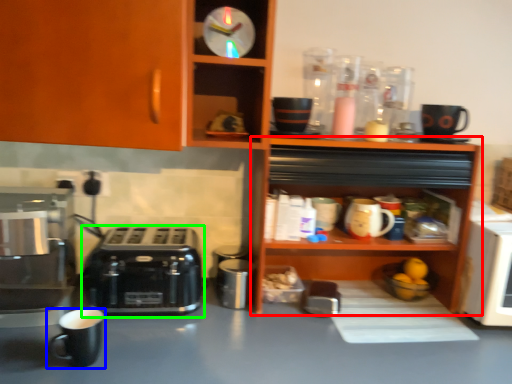
Question: Based on their relative distances, which object is farther from shelf (highlighted by a red box)? Choose from coffee cup (highlighted by a blue box) and toaster (highlighted by a green box).

Choices:
 (A) coffee cup
 (B) toaster

Answer: (A)